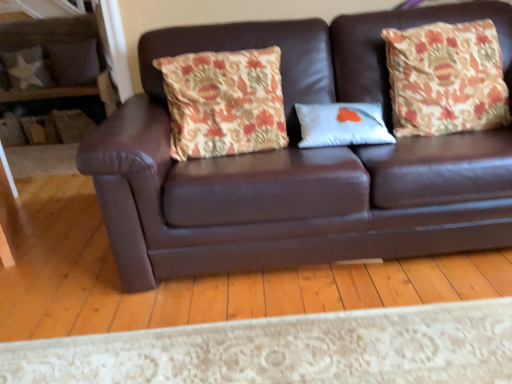
Question: From a real-world perspective, is floral fabric pillow at right, arranged as the 1th throw pillow when viewed from the right, on top of camouflage fabric pillow at upper left, the 1th pillow from the left?

Choices:
 (A) yes
 (B) no

Answer: (A)

Question: Is floral fabric pillow at right, arranged as the second throw pillow when viewed from the left, not near camouflage fabric pillow at upper left, the 2th pillow when ordered from top to bottom?

Choices:
 (A) yes
 (B) no

Answer: (A)

Question: Considering the relative sizes of floral fabric pillow at right, arranged as the 1th throw pillow when viewed from the right, and camouflage fabric pillow at upper left, the 3th pillow when ordered from front to back, in the image provided, is floral fabric pillow at right, arranged as the 1th throw pillow when viewed from the right, thinner than camouflage fabric pillow at upper left, the 3th pillow when ordered from front to back,?

Choices:
 (A) yes
 (B) no

Answer: (B)

Question: Is floral fabric pillow at right, arranged as the 1th throw pillow when viewed from the right, turned away from camouflage fabric pillow at upper left, the 2th pillow when ordered from top to bottom?

Choices:
 (A) no
 (B) yes

Answer: (A)

Question: Does floral fabric pillow at right, arranged as the second throw pillow when viewed from the left, appear on the right side of camouflage fabric pillow at upper left, the third pillow viewed from the right?

Choices:
 (A) yes
 (B) no

Answer: (A)

Question: From a real-world perspective, is floral fabric pillow at right, arranged as the 1th throw pillow when viewed from the right, above or below brown leather couch at center?

Choices:
 (A) below
 (B) above

Answer: (B)

Question: Looking at their shapes, would you say floral fabric pillow at right, arranged as the second throw pillow when viewed from the left, is wider or thinner than brown leather couch at center?

Choices:
 (A) thin
 (B) wide

Answer: (A)

Question: Relative to brown leather couch at center, is floral fabric pillow at right, arranged as the second throw pillow when viewed from the left, in front or behind?

Choices:
 (A) behind
 (B) front

Answer: (A)

Question: Is floral fabric pillow at right, arranged as the 1th throw pillow when viewed from the right, inside the boundaries of brown leather couch at center, or outside?

Choices:
 (A) outside
 (B) inside

Answer: (B)

Question: In the image, is floral fabric pillow at right, arranged as the second throw pillow when viewed from the left, positioned in front of or behind floral fabric pillow at center, which is the first throw pillow in left-to-right order?

Choices:
 (A) behind
 (B) front

Answer: (A)

Question: Considering the positions of floral fabric pillow at right, arranged as the 1th throw pillow when viewed from the right, and floral fabric pillow at center, which is the first throw pillow in left-to-right order, in the image, is floral fabric pillow at right, arranged as the 1th throw pillow when viewed from the right, bigger or smaller than floral fabric pillow at center, which is the first throw pillow in left-to-right order,?

Choices:
 (A) big
 (B) small

Answer: (A)

Question: From the image's perspective, is floral fabric pillow at right, arranged as the 1th throw pillow when viewed from the right, positioned above or below floral fabric pillow at center, which is the first throw pillow in left-to-right order?

Choices:
 (A) below
 (B) above

Answer: (B)

Question: Does point [446, 28] appear closer or farther from the camera than point [203, 54]?

Choices:
 (A) closer
 (B) farther

Answer: (A)

Question: Which is correct: floral fabric pillow at right, arranged as the 1th throw pillow when viewed from the right, is inside floral fabric pillow at upper left, acting as the second pillow starting from the left, or outside of it?

Choices:
 (A) outside
 (B) inside

Answer: (A)

Question: From a real-world perspective, is floral fabric pillow at right, arranged as the 1th throw pillow when viewed from the right, above or below floral fabric pillow at upper left, which ranks as the second pillow in front-to-back order?

Choices:
 (A) below
 (B) above

Answer: (B)